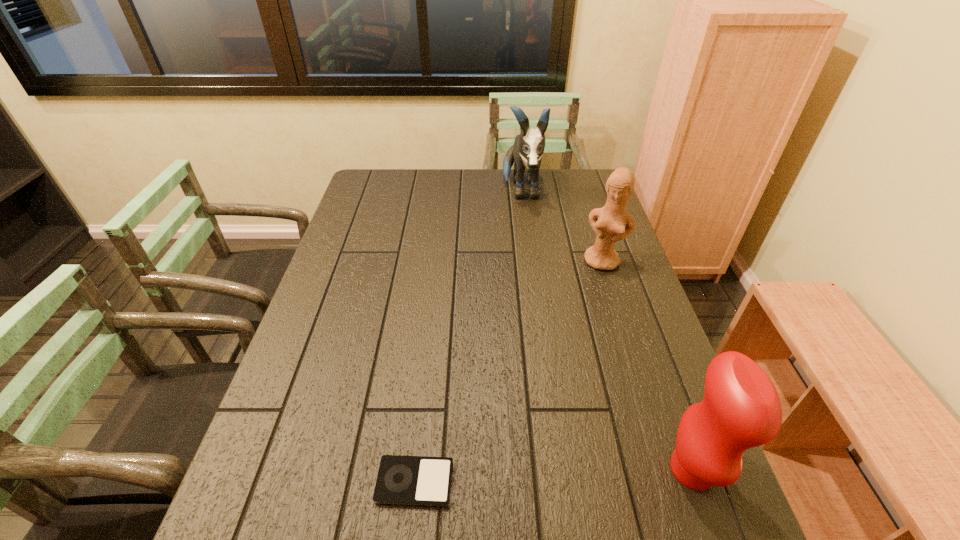
The width and height of the screenshot is (960, 540). In the image, there is a desktop. Find the location of `vacant space at the near edge`. vacant space at the near edge is located at coordinates (356, 502).

The image size is (960, 540). What are the coordinates of `free region at the left edge of the desktop` in the screenshot? It's located at (257, 447).

This screenshot has width=960, height=540. In the image, there is a desktop. What are the coordinates of `free space at the right edge` in the screenshot? It's located at (678, 402).

Find the location of `vacant space at the far left corner of the desktop`. vacant space at the far left corner of the desktop is located at coordinates (366, 186).

Find the location of a particular element. This screenshot has width=960, height=540. vacant space at the far right corner of the desktop is located at coordinates (600, 184).

You are a GUI agent. You are given a task and a screenshot of the screen. Output one action in this format:
    pyautogui.click(x=<x>, y=<y>)
    Task: Click on the free space at the near right corner
    
    Given the screenshot: What is the action you would take?
    pyautogui.click(x=716, y=497)

You are a GUI agent. You are given a task and a screenshot of the screen. Output one action in this format:
    pyautogui.click(x=<x>, y=<y>)
    Task: Click on the free space between the tallest object and the leftmost object
    The width and height of the screenshot is (960, 540).
    Given the screenshot: What is the action you would take?
    pyautogui.click(x=468, y=336)

Find the location of a particular element. Image resolution: width=960 pixels, height=540 pixels. empty space that is in between the puppy and the shortest object is located at coordinates (468, 336).

The height and width of the screenshot is (540, 960). What are the coordinates of `unoccupied area between the farthest object and the shortest object` in the screenshot? It's located at (x=468, y=336).

I want to click on free space that is in between the shortest object and the figurine, so click(509, 372).